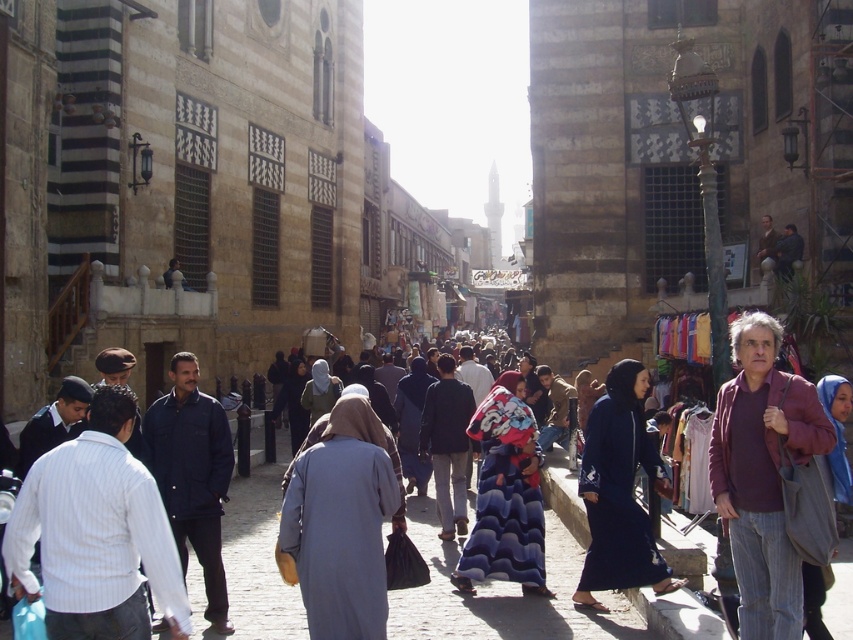
You are standing at the point marked as point (x=619, y=492) in the bustling street scene. What object is located exactly at that point?

The dark blue fabric abaya at center is located exactly at point (x=619, y=492).

In the scene shown: You are standing on a historic Middle Eastern street with stone buildings and cobblestones. You notice two points marked in the scene. The first point is at coordinates approximately [375,577], and the second is at [512,496]. If you were to walk from your current position towards these points, which one would you reach first?

The point at coordinates [375,577] would be reached first because it is closer to the viewer compared to the point at [512,496].